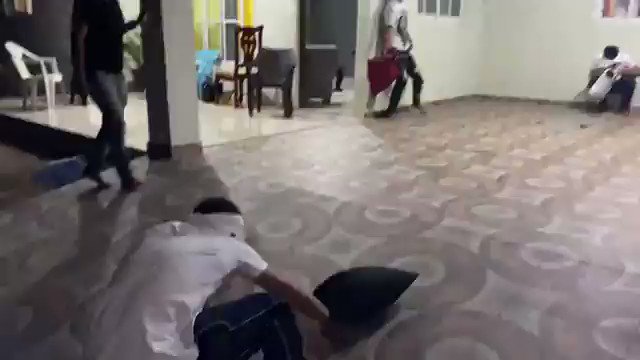
In order to click on entry in this screenshot , I will do `click(340, 27)`.